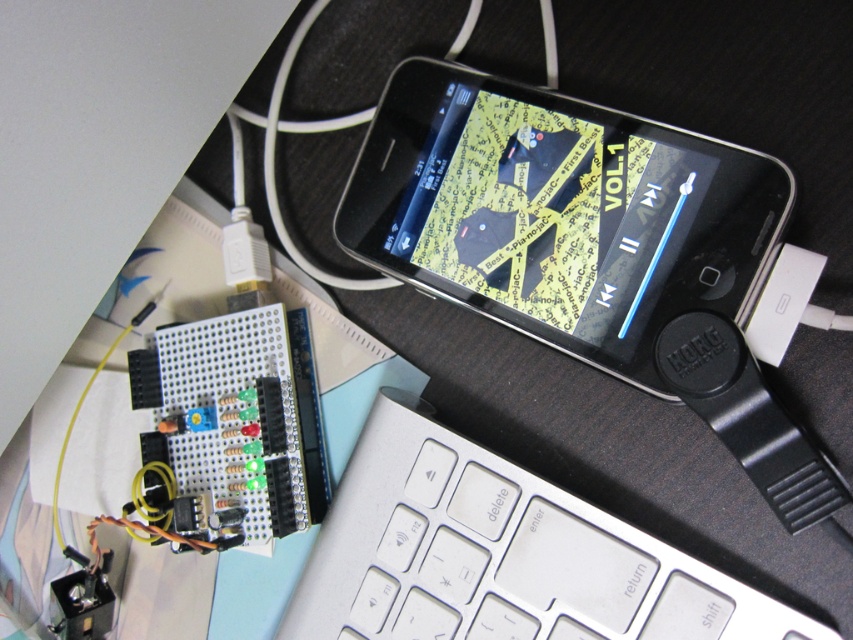
Is point (396, 275) more distant than point (521, 573)?

Yes, point (396, 275) is behind point (521, 573).

Is point (502, 209) in front of point (485, 541)?

No, it is behind (485, 541).

Who is more forward, (x=486, y=152) or (x=509, y=572)?

Point (x=509, y=572)

Image resolution: width=853 pixels, height=640 pixels. Identify the location of satin black ipod at upper center. (560, 212).